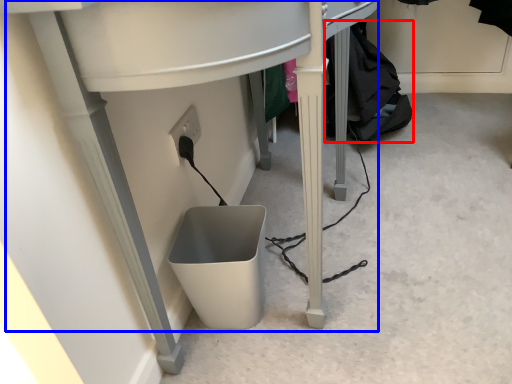
Question: Which of the following is the closest to the observer, clothing (highlighted by a red box) or computer desk (highlighted by a blue box)?

Choices:
 (A) clothing
 (B) computer desk

Answer: (B)